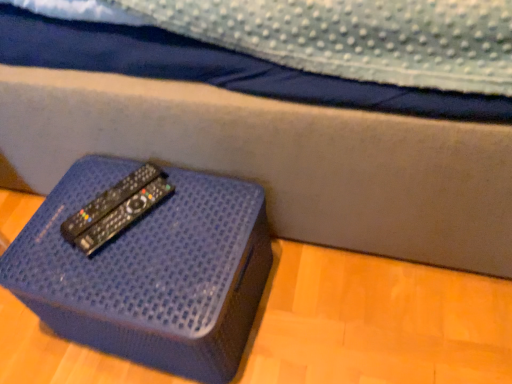
Locate an element on the screen. The height and width of the screenshot is (384, 512). vacant position to the left of black plastic remote at center is located at coordinates (55, 218).